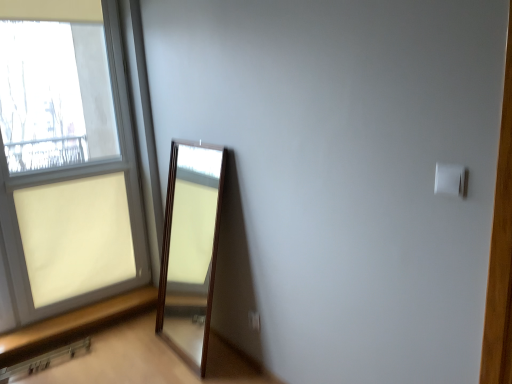
Question: From the image's perspective, is white plastic light switch at upper right positioned above or below brown wooden window sill at lower left?

Choices:
 (A) below
 (B) above

Answer: (B)

Question: From a real-world perspective, is white plastic light switch at upper right positioned above or below brown wooden window sill at lower left?

Choices:
 (A) above
 (B) below

Answer: (A)

Question: Considering the real-world distances, which object is farthest from the matte glass window at left?

Choices:
 (A) white plastic light switch at upper right
 (B) white plastic electric outlet at lower center
 (C) brown wooden window sill at lower left

Answer: (A)

Question: Which object is the closest to the matte glass window at left?

Choices:
 (A) white plastic light switch at upper right
 (B) white plastic electric outlet at lower center
 (C) brown wooden window sill at lower left

Answer: (C)